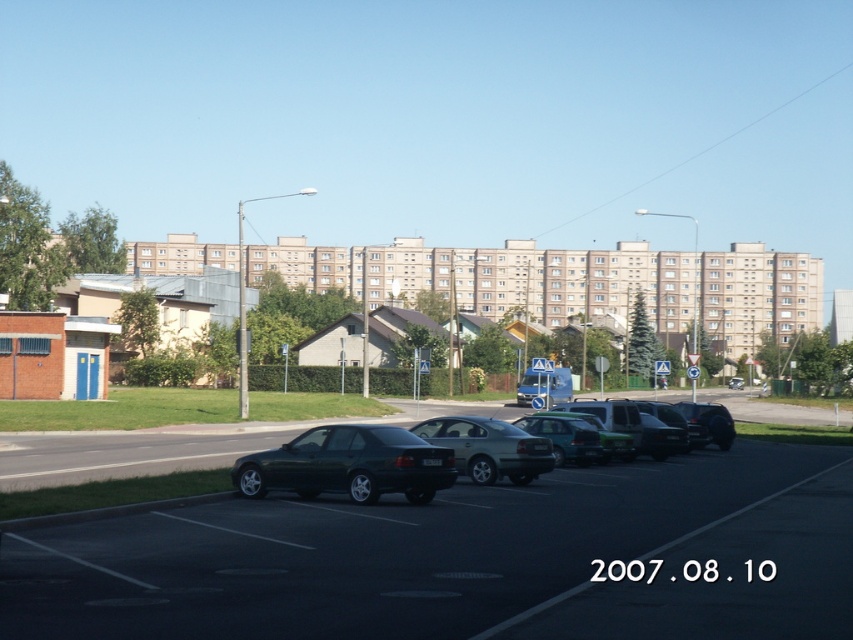
Based on the photo, you are a parking attendant who needs to fit both the matte gray sedan at center and the metallic gray sedan at center into a parking space that can accommodate a vehicle up to 4.5 meters long. Which car should you park first to ensure both fit?

The matte gray sedan at center is smaller than the metallic gray sedan at center. Therefore, you should park the metallic gray sedan at center first since it requires more space, ensuring there is enough room left for the smaller matte gray sedan at center.

You are a delivery driver who needs to park your vehicle between two sedans in the parking lot. The two sedans are the matte gray sedan at center and the metallic gray sedan at center. Which sedan should you park next to if you want your vehicle to be on the right side of the parking space?

You should park next to the matte gray sedan at center because it is positioned to the left of the metallic gray sedan at center, so placing your vehicle to its right would align with the parking space.